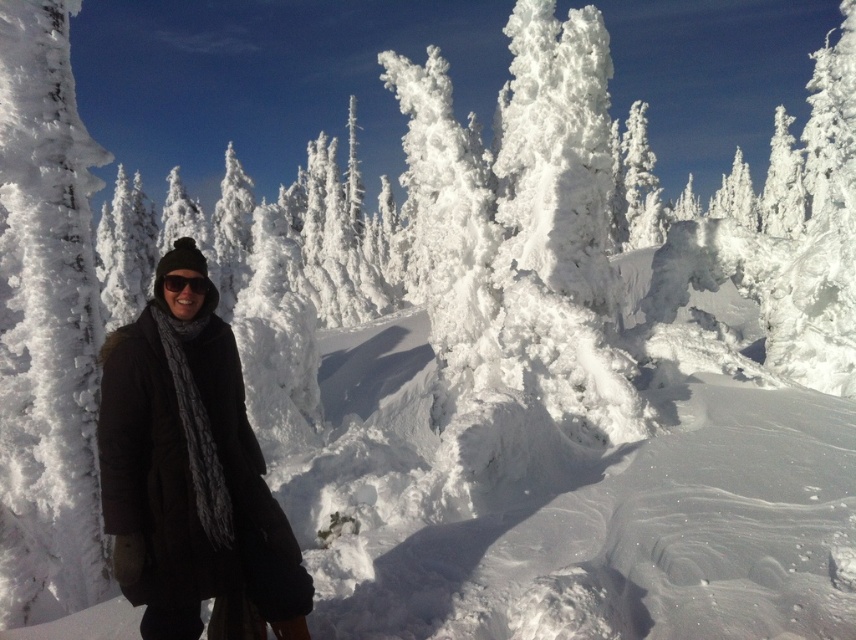
Between black woolen coat at center and white frosty tree at upper right, which one has more height?

white frosty tree at upper right is taller.

Does black woolen coat at center have a greater width compared to white frosty tree at upper right?

In fact, black woolen coat at center might be narrower than white frosty tree at upper right.

Is point (123, 548) positioned behind point (789, 212)?

No, it is not.

This screenshot has height=640, width=856. Find the location of `black woolen coat at center`. black woolen coat at center is located at coordinates (189, 470).

Is black woolen coat at center in front of black matte sunglasses at center?

Yes, it is.

Is black woolen coat at center bigger than black matte sunglasses at center?

Yes, black woolen coat at center is bigger than black matte sunglasses at center.

The width and height of the screenshot is (856, 640). I want to click on black woolen coat at center, so click(189, 470).

Identify the location of black woolen coat at center. The height and width of the screenshot is (640, 856). (189, 470).

From the picture: Does white frosty tree at upper right have a smaller size compared to black matte sunglasses at center?

No.

Who is positioned more to the left, white frosty tree at upper right or black matte sunglasses at center?

black matte sunglasses at center

What do you see at coordinates (783, 182) in the screenshot? I see `white frosty tree at upper right` at bounding box center [783, 182].

Find the location of a particular element. The image size is (856, 640). white frosty tree at upper right is located at coordinates (783, 182).